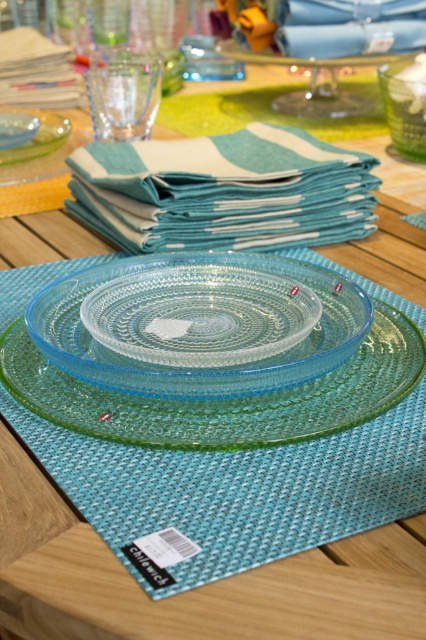
Question: Which point appears farthest from the camera in this image?

Choices:
 (A) (100, 188)
 (B) (379, 74)

Answer: (B)

Question: Does transparent glass plate at center have a greater width compared to transparent glass plate at upper left?

Choices:
 (A) yes
 (B) no

Answer: (A)

Question: Which point is farther to the camera?

Choices:
 (A) transparent glass plate at center
 (B) green textured glass bowl at upper right
 (C) teal woven cloth at upper center

Answer: (B)

Question: Does transparent glass platter at center appear on the left side of green textured glass bowl at upper right?

Choices:
 (A) no
 (B) yes

Answer: (B)

Question: Which point is closer to the camera?

Choices:
 (A) teal woven cloth at upper center
 (B) transparent glass plate at upper left

Answer: (A)

Question: Is teal woven cloth at upper center to the left of transparent glass plate at center from the viewer's perspective?

Choices:
 (A) no
 (B) yes

Answer: (A)